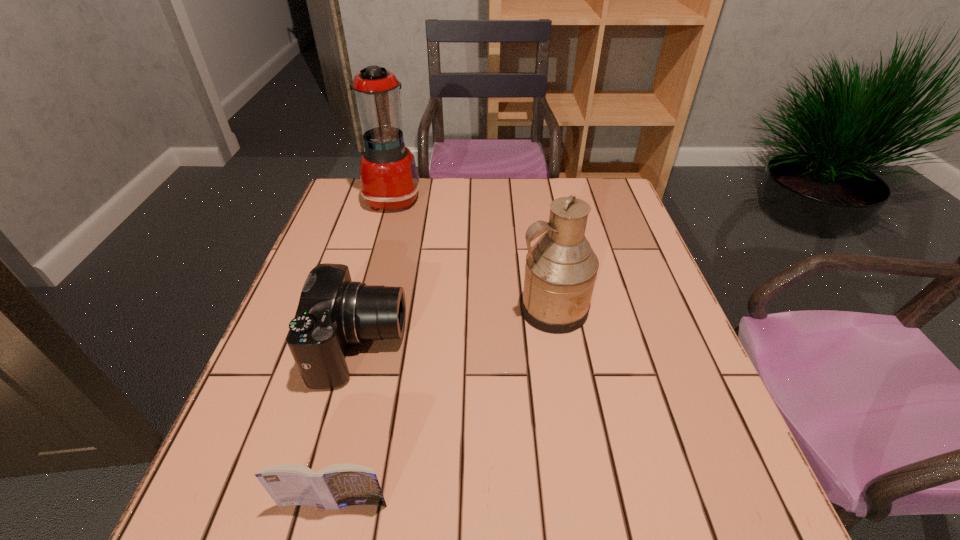
You are a GUI agent. You are given a task and a screenshot of the screen. Output one action in this format:
    pyautogui.click(x=<x>, y=<y>)
    Task: Click on the free space between the tallest object and the nearest object
    This screenshot has height=540, width=960.
    Given the screenshot: What is the action you would take?
    pyautogui.click(x=364, y=350)

You are a GUI agent. You are given a task and a screenshot of the screen. Output one action in this format:
    pyautogui.click(x=<x>, y=<y>)
    Task: Click on the free space between the food processor and the shortest object
    The width and height of the screenshot is (960, 540).
    Given the screenshot: What is the action you would take?
    pyautogui.click(x=364, y=350)

Image resolution: width=960 pixels, height=540 pixels. I want to click on free space that is in between the tallest object and the third shortest object, so click(x=473, y=253).

Identify which object is located as the third nearest to the book. Please provide its 2D coordinates. Your answer should be formatted as a tuple, i.e. [(x, y)], where the tuple contains the x and y coordinates of a point satisfying the conditions above.

[(389, 180)]

Image resolution: width=960 pixels, height=540 pixels. In order to click on object that is the second closest to the second shortest object in this screenshot , I will do `click(561, 267)`.

Where is `free point that satisfies the following two spatial constraints: 1. on the controls of the farthest object; 2. on the back side of the rightmost object`? This screenshot has width=960, height=540. free point that satisfies the following two spatial constraints: 1. on the controls of the farthest object; 2. on the back side of the rightmost object is located at coordinates (363, 309).

Where is `free space that satisfies the following two spatial constraints: 1. on the controls of the farthest object; 2. on the left side of the rightmost object`? This screenshot has height=540, width=960. free space that satisfies the following two spatial constraints: 1. on the controls of the farthest object; 2. on the left side of the rightmost object is located at coordinates (363, 309).

Locate an element on the screen. The height and width of the screenshot is (540, 960). vacant area that satisfies the following two spatial constraints: 1. on the controls of the rightmost object; 2. on the left side of the tallest object is located at coordinates (363, 309).

The image size is (960, 540). Find the location of `vacant space that satisfies the following two spatial constraints: 1. on the controls of the farthest object; 2. on the back side of the rightmost object`. vacant space that satisfies the following two spatial constraints: 1. on the controls of the farthest object; 2. on the back side of the rightmost object is located at coordinates (363, 309).

Locate an element on the screen. vacant space that satisfies the following two spatial constraints: 1. on the controls of the farthest object; 2. on the left side of the rightmost object is located at coordinates (363, 309).